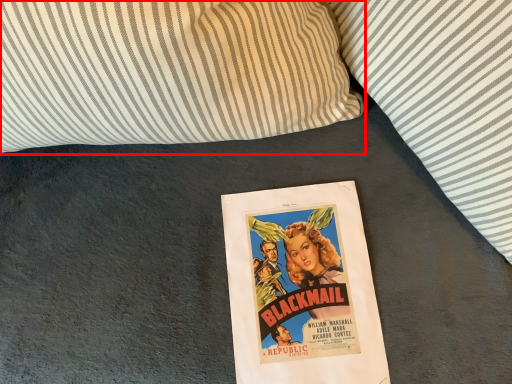
Question: Considering the relative positions of pillow (annotated by the red box) and pillow in the image provided, where is pillow (annotated by the red box) located with respect to the staircase?

Choices:
 (A) left
 (B) right

Answer: (A)